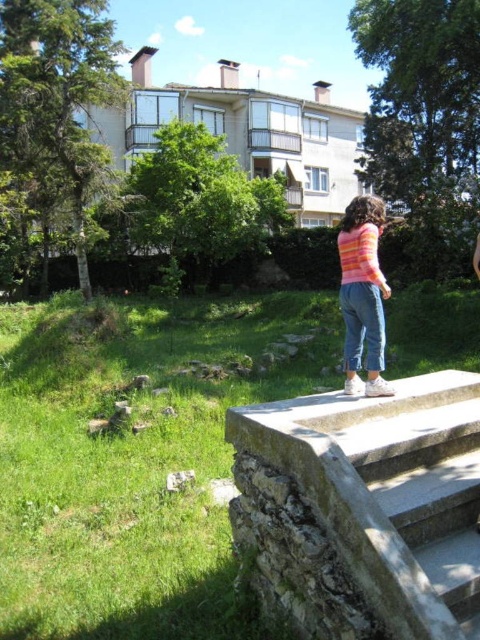
Does point (456, 461) come closer to viewer compared to point (343, 232)?

Yes, it is in front of point (343, 232).

Is stone stairs at center taller than pink striped sweater at center?

No, stone stairs at center is not taller than pink striped sweater at center.

Is point (448, 374) closer to viewer compared to point (380, 339)?

That is False.

Find the location of a particular element. Image resolution: width=480 pixels, height=640 pixels. stone stairs at center is located at coordinates (363, 508).